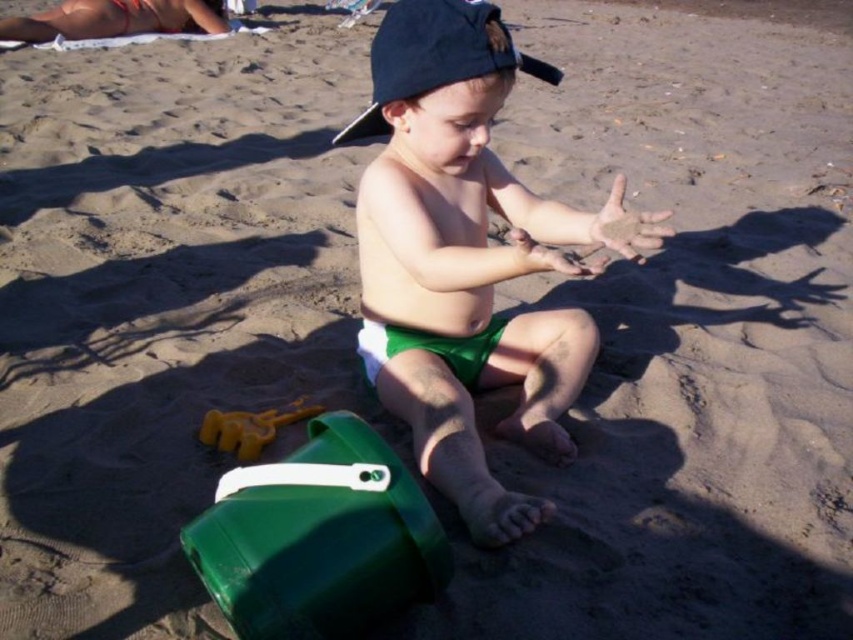
The width and height of the screenshot is (853, 640). In order to click on green fabric toddler at center in this screenshot , I will do pos(465,257).

Is green fabric toddler at center bigger than yellow plastic shovel at lower left?

Yes, green fabric toddler at center is bigger than yellow plastic shovel at lower left.

You are a GUI agent. You are given a task and a screenshot of the screen. Output one action in this format:
    pyautogui.click(x=<x>, y=<y>)
    Task: Click on the green fabric toddler at center
    The image size is (853, 640).
    Given the screenshot: What is the action you would take?
    pyautogui.click(x=465, y=257)

Is point (344, 556) behind point (250, 442)?

No, it is not.

Which is behind, point (373, 516) or point (260, 413)?

Point (260, 413)

Between point (352, 432) and point (294, 410), which one is positioned in front?

Point (352, 432) is more forward.

The height and width of the screenshot is (640, 853). I want to click on green plastic bucket at lower left, so click(318, 538).

Based on the photo, which is more to the right, green fabric toddler at center or green plastic bucket at lower left?

From the viewer's perspective, green fabric toddler at center appears more on the right side.

Is point (424, 253) positioned after point (270, 627)?

Yes, it is.

What are the coordinates of `green fabric toddler at center` in the screenshot? It's located at (465, 257).

Image resolution: width=853 pixels, height=640 pixels. I want to click on green fabric toddler at center, so click(x=465, y=257).